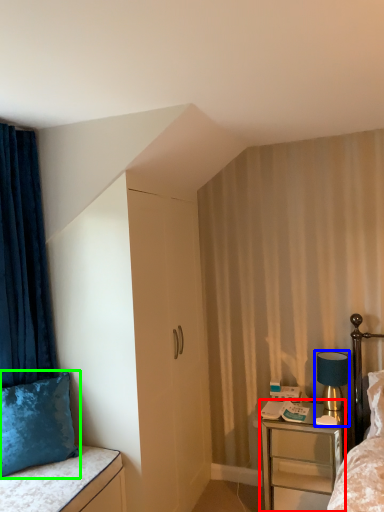
Question: Estimate the real-world distances between objects in this image. Which object is closer to nightstand (highlighted by a red box), bedside lamp (highlighted by a blue box) or pillow (highlighted by a green box)?

Choices:
 (A) bedside lamp
 (B) pillow

Answer: (A)